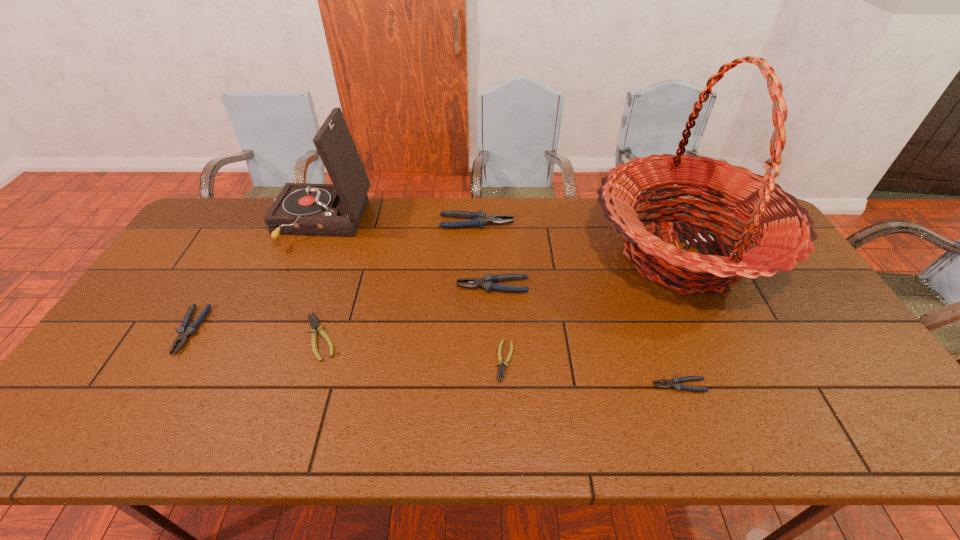
Identify which pliers is the second nearest to the phonograph record. Please provide its 2D coordinates. Your answer should be formatted as a tuple, i.e. [(x, y)], where the tuple contains the x and y coordinates of a point satisfying the conditions above.

[(479, 219)]

Identify the location of the fourth closest pliers to the rightmost pliers. The image size is (960, 540). (314, 324).

Identify which gray pliers is located as the third nearest to the left yellow pliers. Please provide its 2D coordinates. Your answer should be formatted as a tuple, i.e. [(x, y)], where the tuple contains the x and y coordinates of a point satisfying the conditions above.

[(479, 219)]

The image size is (960, 540). Identify the location of gray pliers that can be found as the third closest to the second tallest object. click(487, 282).

Where is `free space that satisfies the following two spatial constraints: 1. at the gripping part of the second farthest pliers; 2. at the gripping part of the fourth shortest pliers`? The height and width of the screenshot is (540, 960). free space that satisfies the following two spatial constraints: 1. at the gripping part of the second farthest pliers; 2. at the gripping part of the fourth shortest pliers is located at coordinates (493, 330).

Locate an element on the screen. The image size is (960, 540). vacant space that satisfies the following two spatial constraints: 1. at the gripping part of the fifth tallest object; 2. on the left side of the left yellow pliers is located at coordinates pyautogui.click(x=186, y=337).